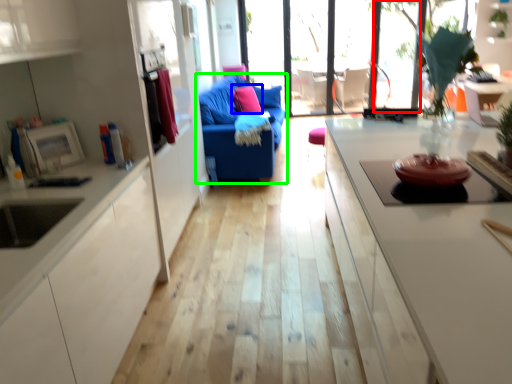
Question: Considering the real-world distances, which object is farthest from window (highlighted by a red box)? pillow (highlighted by a blue box) or studio couch (highlighted by a green box)?

Choices:
 (A) pillow
 (B) studio couch

Answer: (B)